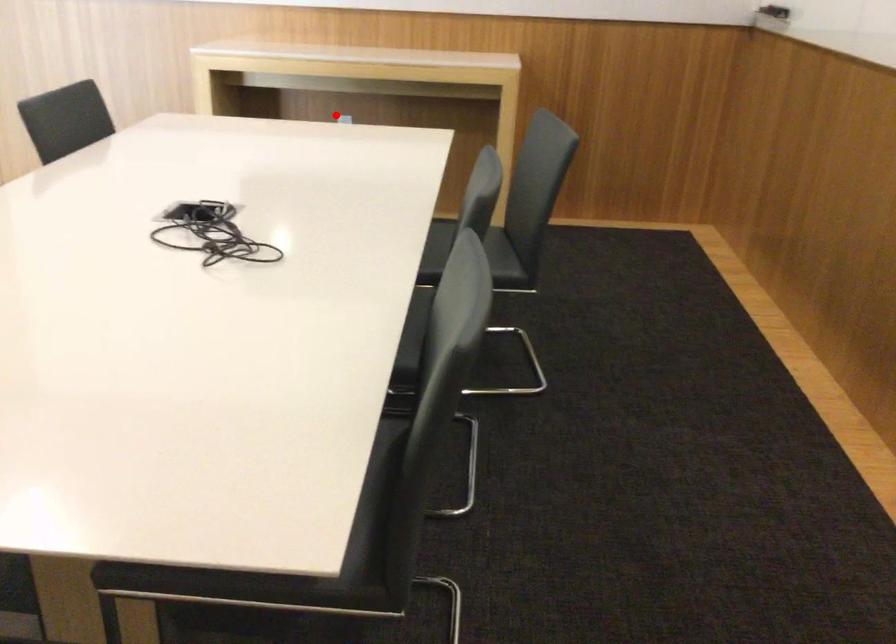
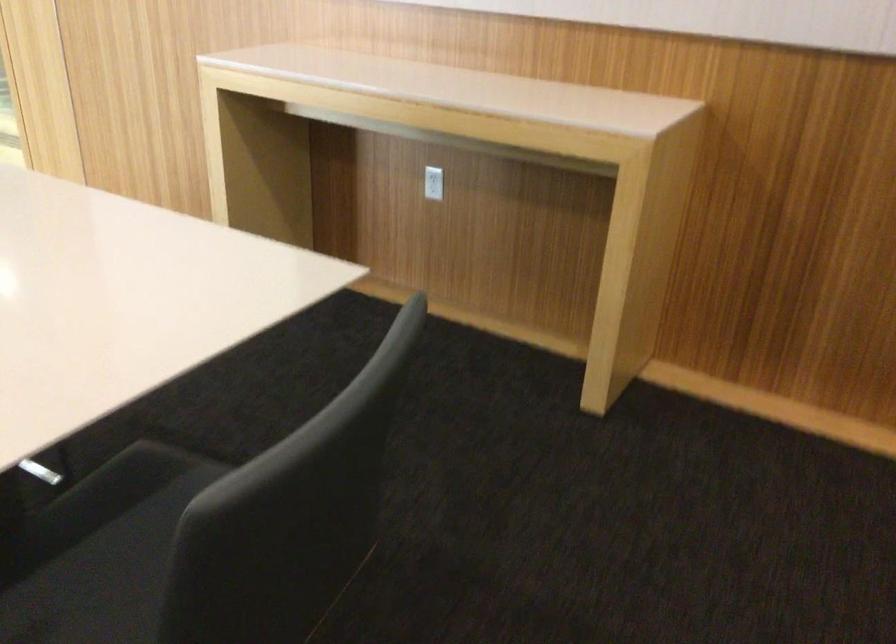
Question: I am providing you with two images of the same scene from different viewpoints. A red point is shown in image1. For the corresponding object point in image2, is it positioned nearer or farther from the camera?

Choices:
 (A) Nearer
 (B) Farther

Answer: (A)